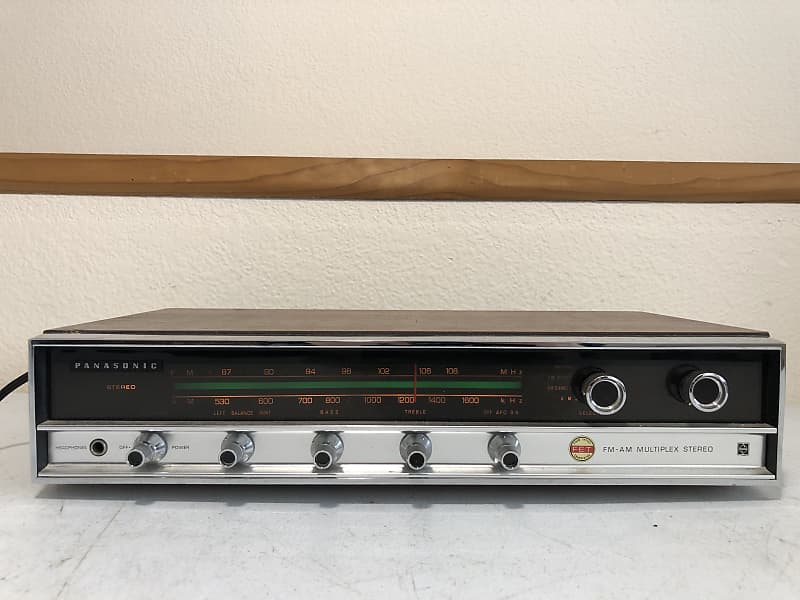
Image resolution: width=800 pixels, height=600 pixels. Find the location of `cord plug-in ports`. cord plug-in ports is located at coordinates (144, 447), (244, 446), (325, 452), (420, 440), (508, 450).